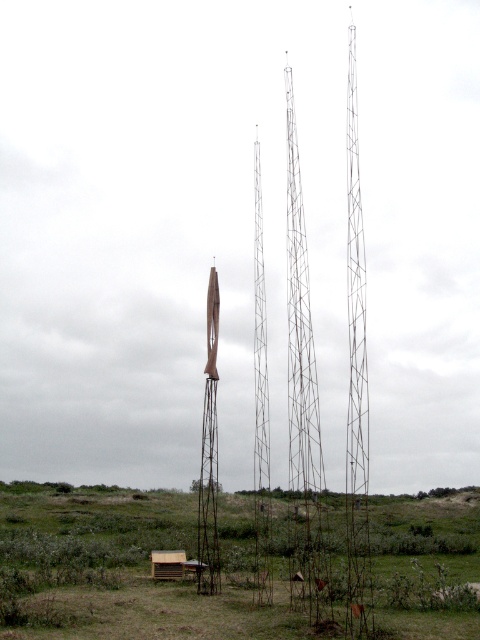
Question: From the image, what is the correct spatial relationship of metallic grid tower at center in relation to shiny metallic rocket at center?

Choices:
 (A) left
 (B) right

Answer: (B)

Question: Is metallic grid tower at center to the left of shiny metallic rocket at center from the viewer's perspective?

Choices:
 (A) no
 (B) yes

Answer: (A)

Question: Can you confirm if metallic grid tower at center is positioned to the left of shiny metallic rocket at center?

Choices:
 (A) no
 (B) yes

Answer: (A)

Question: Which of the following is the farthest from the observer?

Choices:
 (A) metallic grid tower at center
 (B) shiny metallic rocket at center

Answer: (B)